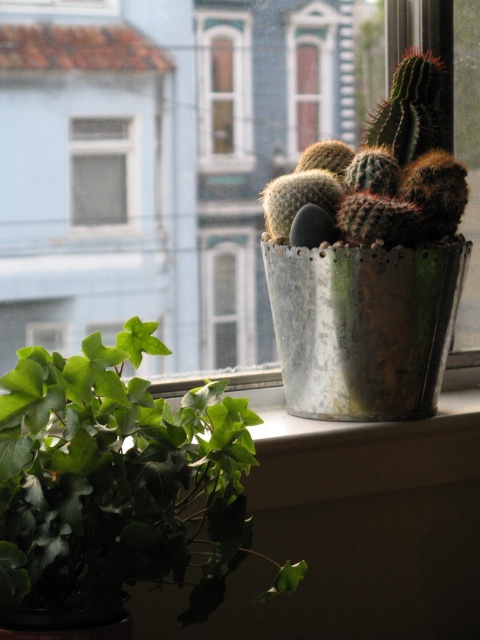
From the picture: You are an interior designer assessing the lighting in the room. You notice the green glass window at upper center and the transparent glass window at upper center. Which window allows more natural light into the room?

The transparent glass window at upper center allows more natural light into the room because it is not tinted like the green glass window at upper center.

You are standing in the room and want to touch both the green matte ivy at center and the green glass window at upper center. Which object will require you to reach higher?

The green glass window at upper center is higher than the green matte ivy at center, so you will need to reach higher to touch the green glass window at upper center.

You are an interior designer planning to place a decorative item between the green matte ivy at center and the green glass window at upper center. Considering their sizes, which object should the item be placed closer to to ensure it fits better?

The decorative item should be placed closer to the green glass window at upper center because the green matte ivy at center is wider, leaving less space between them for the item to fit comfortably.